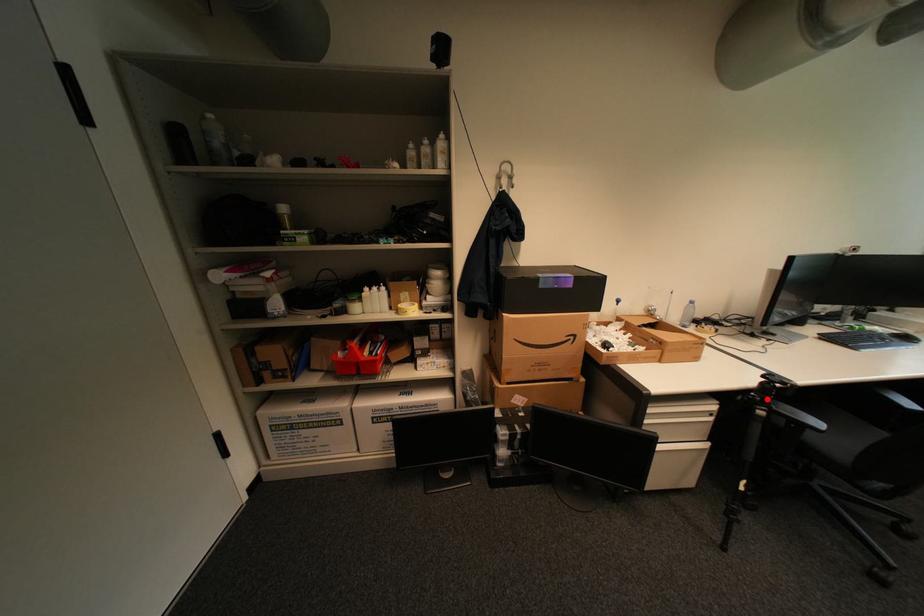
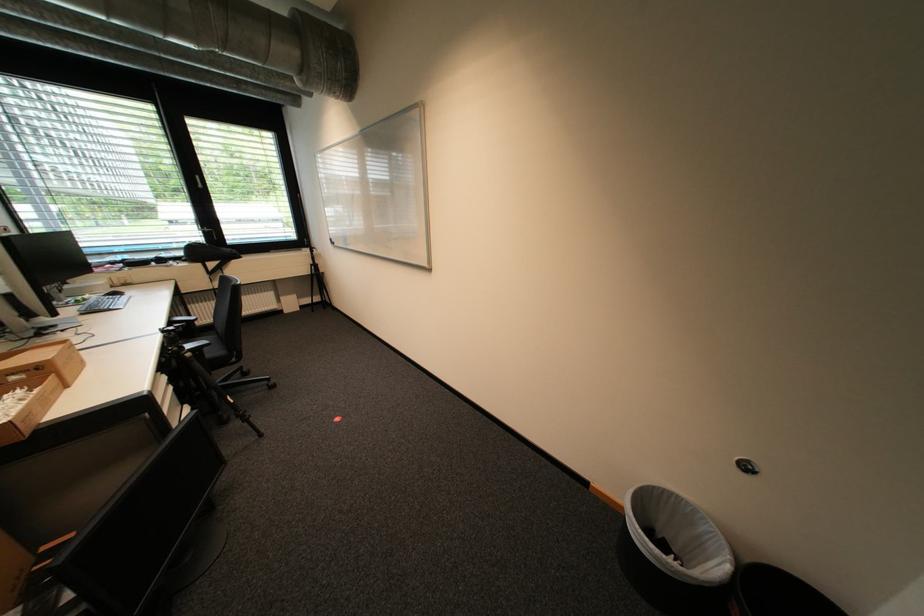
Find the pixel in the second image that matches the highlighted location in the first image.

(185, 349)